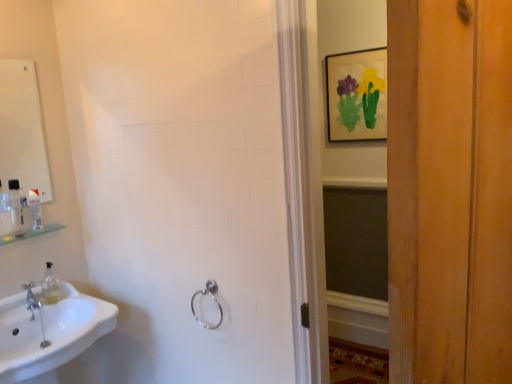
Question: Considering the positions of clear plastic bottle at left, which appears as the 1th toiletry when viewed from the back, and silver metallic towel ring at lower center in the image, is clear plastic bottle at left, which appears as the 1th toiletry when viewed from the back, taller or shorter than silver metallic towel ring at lower center?

Choices:
 (A) short
 (B) tall

Answer: (A)

Question: Considering the positions of point (35, 211) and point (207, 327), is point (35, 211) closer or farther from the camera than point (207, 327)?

Choices:
 (A) farther
 (B) closer

Answer: (A)

Question: Which of these objects is positioned farthest from the matte paper picture frame at upper center?

Choices:
 (A) white glossy sink at lower left
 (B) white glossy mirror at upper left
 (C) clear plastic bottle at left, which appears as the 1th toiletry when viewed from the back
 (D) clear plastic bottle at upper left, placed as the first toiletry when sorted from front to back
 (E) silver metallic towel ring at lower center

Answer: (D)

Question: Estimate the real-world distances between objects in this image. Which object is closer to the matte paper picture frame at upper center?

Choices:
 (A) white glossy sink at lower left
 (B) green glass shelf at left
 (C) clear plastic bottle at left, which appears as the 1th toiletry when viewed from the back
 (D) clear plastic bottle at upper left, placed as the first toiletry when sorted from front to back
 (E) silver metallic towel ring at lower center

Answer: (E)